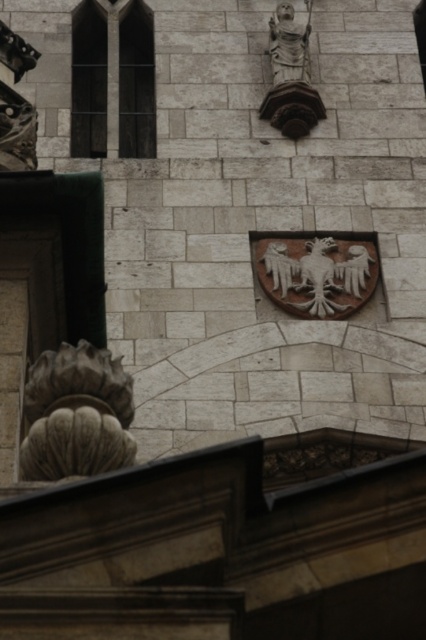
Question: Which point appears closest to the camera in this image?

Choices:
 (A) (282, 6)
 (B) (351, 248)

Answer: (B)

Question: Which of these objects is positioned farthest from the brown stone shield at center?

Choices:
 (A) carved stone ornament at left
 (B) stone statue at upper center

Answer: (A)

Question: Can you confirm if carved stone ornament at left is wider than stone statue at upper center?

Choices:
 (A) no
 (B) yes

Answer: (A)

Question: Is carved stone ornament at left further to the viewer compared to stone statue at upper center?

Choices:
 (A) no
 (B) yes

Answer: (A)

Question: Among these points, which one is farthest from the camera?

Choices:
 (A) (339, 241)
 (B) (302, 52)
 (C) (86, 404)

Answer: (B)

Question: Does brown stone shield at center lie behind stone statue at upper center?

Choices:
 (A) yes
 (B) no

Answer: (B)